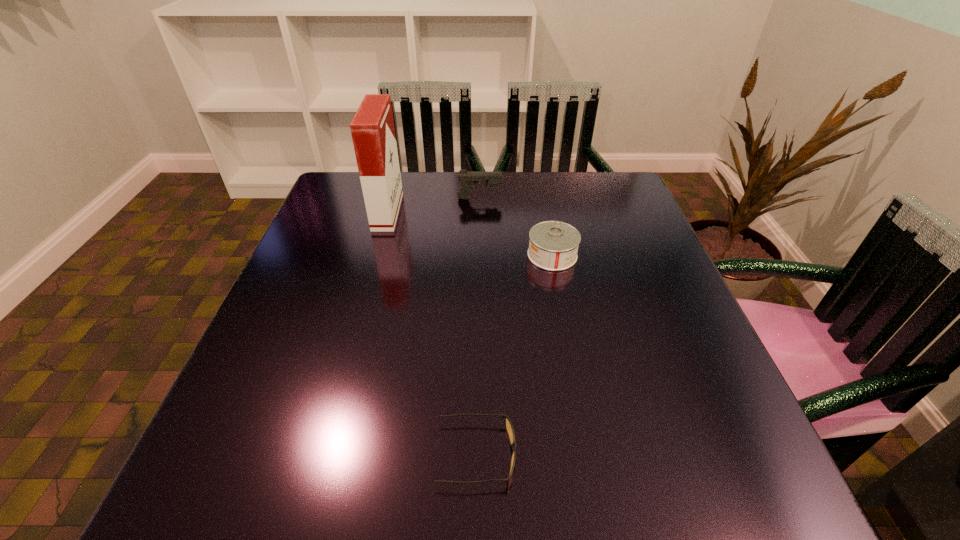
Locate an element on the screen. The width and height of the screenshot is (960, 540). unoccupied area between the second tallest object and the third tallest object is located at coordinates (516, 227).

Find the location of a particular element. Image resolution: width=960 pixels, height=540 pixels. free space between the pistol and the tallest object is located at coordinates (434, 205).

Point out which object is positioned as the nearest to the pistol. Please provide its 2D coordinates. Your answer should be formatted as a tuple, i.e. [(x, y)], where the tuple contains the x and y coordinates of a point satisfying the conditions above.

[(372, 128)]

Select which object is the second closest to the second shortest object. Please provide its 2D coordinates. Your answer should be formatted as a tuple, i.e. [(x, y)], where the tuple contains the x and y coordinates of a point satisfying the conditions above.

[(372, 128)]

Where is `free space that satisfies the following two spatial constraints: 1. on the front-facing side of the rightmost object; 2. on the right side of the tallest object`? free space that satisfies the following two spatial constraints: 1. on the front-facing side of the rightmost object; 2. on the right side of the tallest object is located at coordinates (375, 255).

Image resolution: width=960 pixels, height=540 pixels. Identify the location of blank space that satisfies the following two spatial constraints: 1. on the front-facing side of the leftmost object; 2. on the back side of the can. (x=375, y=255).

Identify the location of vacant region that satisfies the following two spatial constraints: 1. at the barrel of the second nearest object; 2. on the left side of the pistol. The image size is (960, 540). (480, 255).

You are a GUI agent. You are given a task and a screenshot of the screen. Output one action in this format:
    pyautogui.click(x=<x>, y=<y>)
    Task: Click on the free space that satisfies the following two spatial constraints: 1. at the barrel of the pistol; 2. on the back side of the rightmost object
    The height and width of the screenshot is (540, 960).
    Given the screenshot: What is the action you would take?
    pyautogui.click(x=480, y=255)